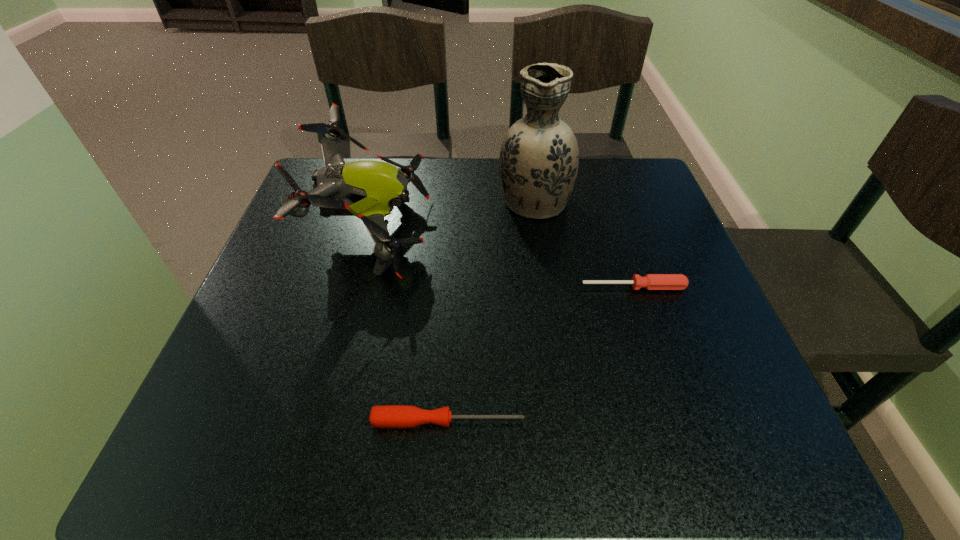
The height and width of the screenshot is (540, 960). Identify the location of blank space at the far left corner. (303, 190).

In the image, there is a desktop. Where is `vacant space at the near left corner`? vacant space at the near left corner is located at coordinates (250, 438).

The width and height of the screenshot is (960, 540). Find the location of `vacant region at the far right corner`. vacant region at the far right corner is located at coordinates (600, 158).

Where is `free spot between the tallest object and the nearer screwdriver`? The image size is (960, 540). free spot between the tallest object and the nearer screwdriver is located at coordinates (492, 310).

The width and height of the screenshot is (960, 540). I want to click on vacant space that's between the tallest object and the nearer screwdriver, so click(x=492, y=310).

The width and height of the screenshot is (960, 540). I want to click on blank region between the right screwdriver and the vase, so click(584, 243).

The height and width of the screenshot is (540, 960). In order to click on empty space between the tallest object and the farther screwdriver in this screenshot , I will do `click(584, 243)`.

The height and width of the screenshot is (540, 960). I want to click on vacant area that lies between the nearer screwdriver and the vase, so click(492, 310).

The image size is (960, 540). I want to click on empty location between the drone and the left screwdriver, so click(x=411, y=327).

This screenshot has height=540, width=960. What are the coordinates of `free space between the left screwdriver and the farther screwdriver` in the screenshot? It's located at (540, 354).